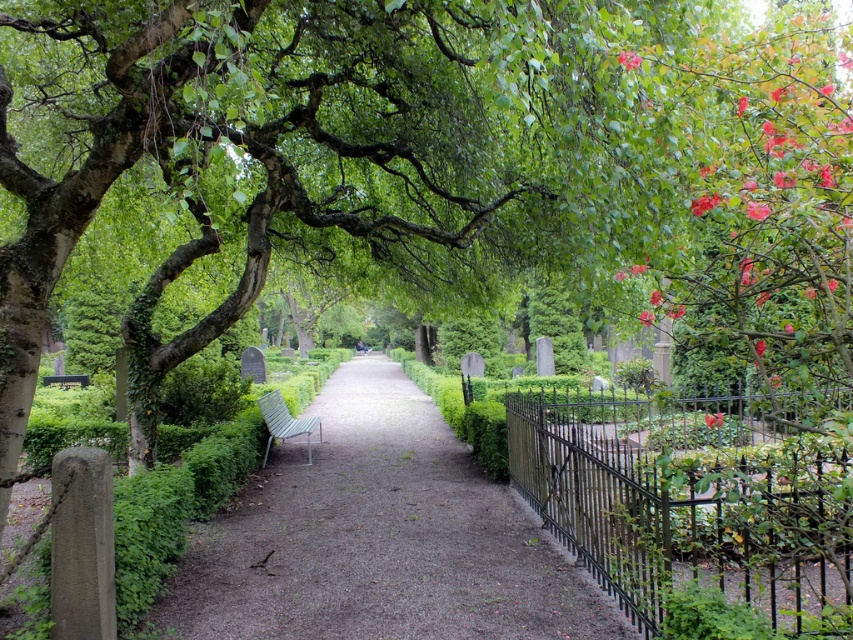
Question: Does green grass at center appear over wooden slats bench at center?

Choices:
 (A) yes
 (B) no

Answer: (B)

Question: Which object appears closest to the camera in this image?

Choices:
 (A) green grass at center
 (B) wooden slats bench at center

Answer: (A)

Question: Can you confirm if green grass at center is smaller than wooden slats bench at center?

Choices:
 (A) yes
 (B) no

Answer: (B)

Question: Can you confirm if green grass at center is bigger than wooden slats bench at center?

Choices:
 (A) yes
 (B) no

Answer: (A)

Question: Which of the following is the farthest from the observer?

Choices:
 (A) (366, 576)
 (B) (300, 426)

Answer: (B)